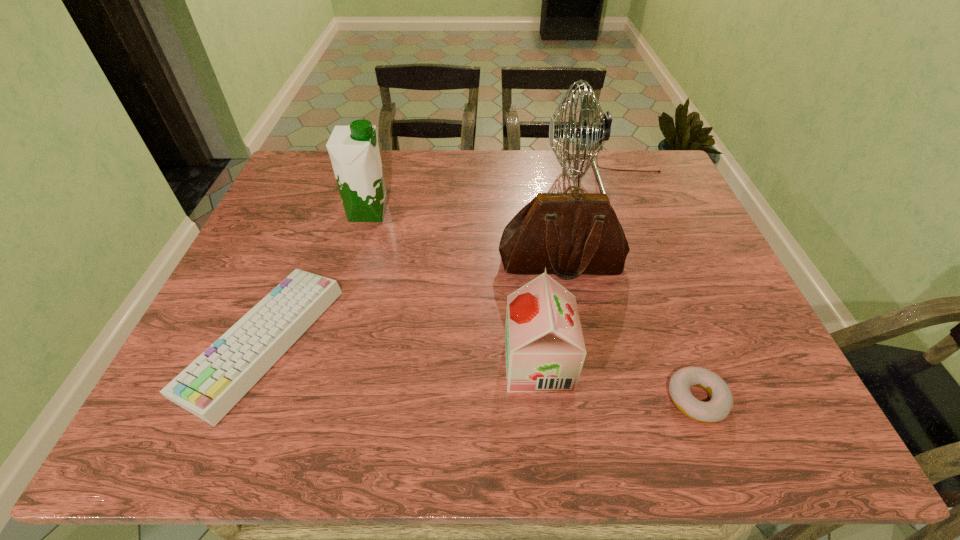
In the image, there is a desktop. At what (x,y) coordinates should I click in order to perform the action: click on free space at the right edge. Please return your answer as a coordinate pair (x, y). Image resolution: width=960 pixels, height=540 pixels. Looking at the image, I should click on (660, 217).

Identify the location of free space at the far right corner. (636, 171).

At what (x,y) coordinates should I click in order to perform the action: click on free space between the second shortest object and the shortest object. Please return your answer as a coordinate pair (x, y). Looking at the image, I should click on (480, 370).

Identify the location of vacant space in between the right soya milk and the shortest object. (617, 381).

Find the location of a particular element. This screenshot has width=960, height=540. empty location between the taller soya milk and the shorter soya milk is located at coordinates [453, 288].

At what (x,y) coordinates should I click in order to perform the action: click on free space between the fan and the doughnut. Please return your answer as a coordinate pair (x, y). The width and height of the screenshot is (960, 540). Looking at the image, I should click on (651, 288).

Locate an element on the screen. vacant area that lies between the doughnut and the fan is located at coordinates (651, 288).

The height and width of the screenshot is (540, 960). What are the coordinates of `free space that is in between the fan and the taller soya milk` in the screenshot? It's located at (487, 195).

Identify which object is the fifth nearest to the computer keyboard. Please provide its 2D coordinates. Your answer should be formatted as a tuple, i.e. [(x, y)], where the tuple contains the x and y coordinates of a point satisfying the conditions above.

[(718, 408)]

You are a GUI agent. You are given a task and a screenshot of the screen. Output one action in this format:
    pyautogui.click(x=<x>, y=<y>)
    Task: Click on the fifth closest object to the taller soya milk
    
    Given the screenshot: What is the action you would take?
    pyautogui.click(x=718, y=408)